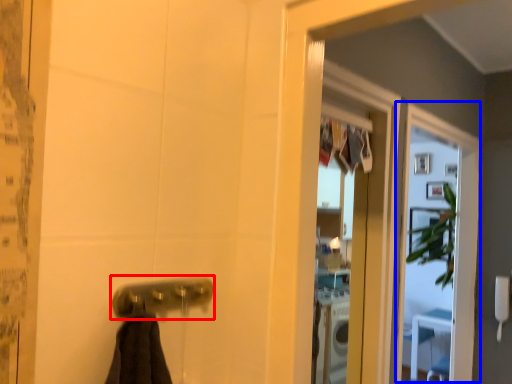
Question: Among these objects, which one is farthest to the camera, door handle (highlighted by a red box) or screen door (highlighted by a blue box)?

Choices:
 (A) door handle
 (B) screen door

Answer: (B)